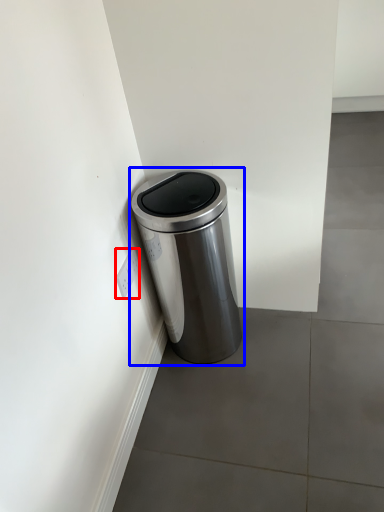
Question: Which object appears closest to the camera in this image, electric outlet (highlighted by a red box) or waste container (highlighted by a blue box)?

Choices:
 (A) electric outlet
 (B) waste container

Answer: (B)